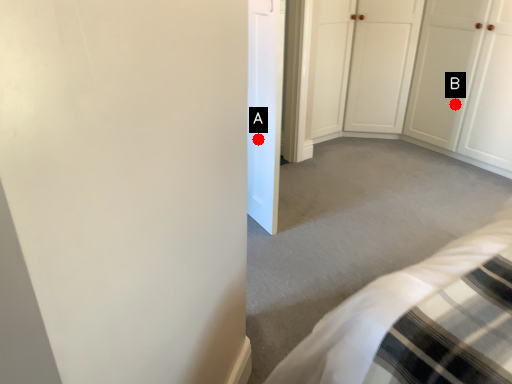
Question: Two points are circled on the image, labeled by A and B beside each circle. Which point appears farthest from the camera in this image?

Choices:
 (A) A is further
 (B) B is further

Answer: (B)